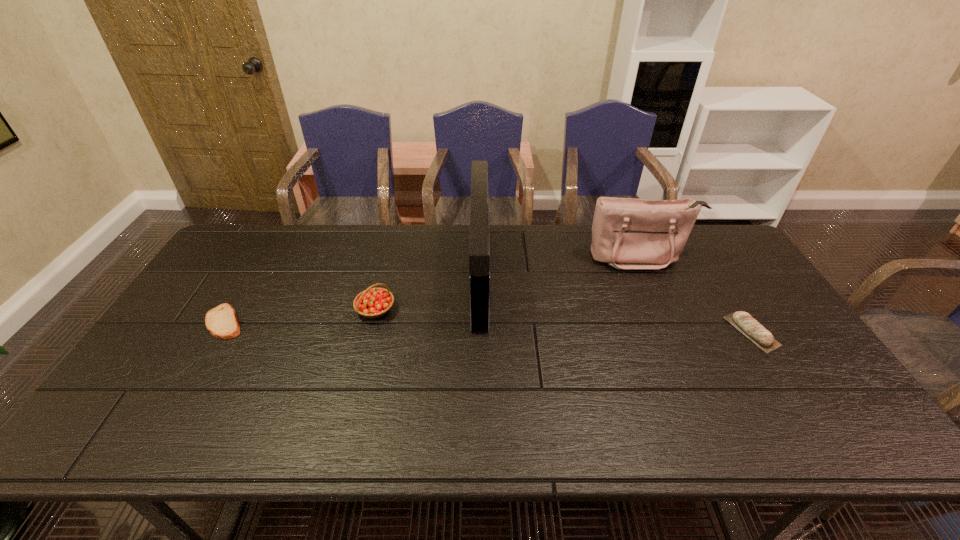
You are a GUI agent. You are given a task and a screenshot of the screen. Output one action in this format:
    pyautogui.click(x=<x>, y=<y>)
    Task: Click on the tallest object
    
    Given the screenshot: What is the action you would take?
    pyautogui.click(x=479, y=242)

Find the location of `videotape`. videotape is located at coordinates (479, 242).

What are the coordinates of `the second tallest object` in the screenshot? It's located at (627, 233).

This screenshot has height=540, width=960. In order to click on the third tallest object in this screenshot , I will do `click(372, 303)`.

This screenshot has width=960, height=540. I want to click on strawberry, so [x=372, y=303].

Locate an element on the screen. the fourth tallest object is located at coordinates (744, 322).

Where is `the right pita bread`? the right pita bread is located at coordinates (744, 322).

At what (x,y) coordinates should I click in order to perform the action: click on the shorter pita bread. Please return your answer as a coordinate pair (x, y). This screenshot has height=540, width=960. Looking at the image, I should click on (222, 322).

Where is `the leftmost object`? The width and height of the screenshot is (960, 540). the leftmost object is located at coordinates (222, 322).

Identify the location of vacant area situated on the front side of the videotape. This screenshot has width=960, height=540. (371, 275).